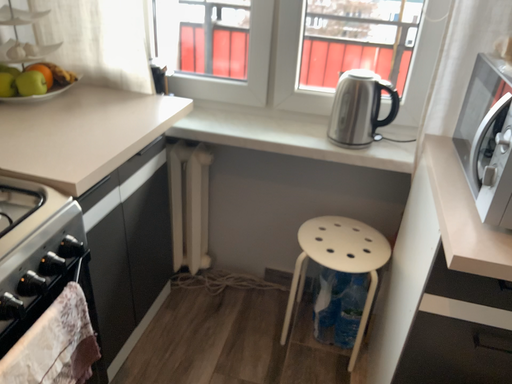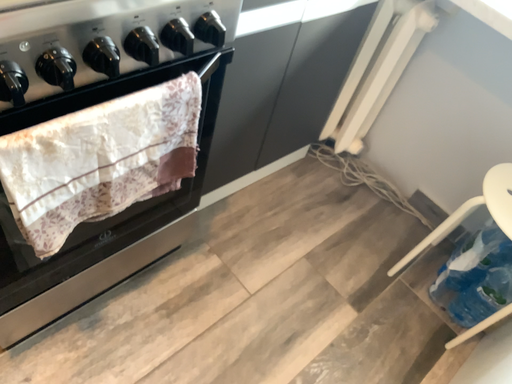
Question: Which way did the camera rotate in the video?

Choices:
 (A) rotated left
 (B) rotated right

Answer: (A)